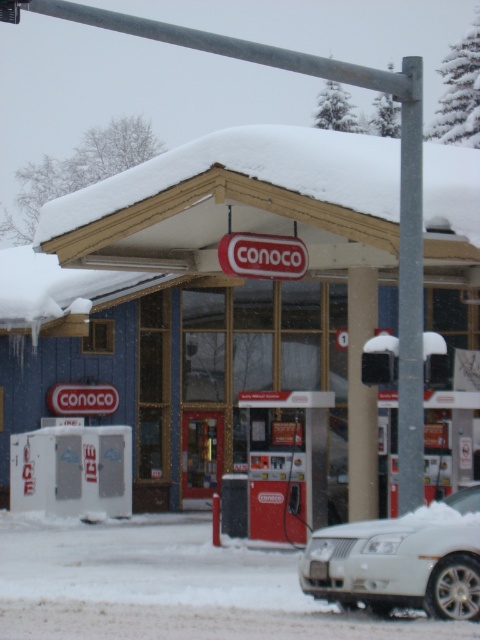
Question: Which point is farther to the camera?

Choices:
 (A) white matte car at lower right
 (B) matte blue gas station at center

Answer: (B)

Question: Considering the relative positions of matte blue gas station at center and white matte car at lower right in the image provided, where is matte blue gas station at center located with respect to white matte car at lower right?

Choices:
 (A) above
 (B) below

Answer: (A)

Question: Does matte blue gas station at center have a lesser width compared to white matte car at lower right?

Choices:
 (A) yes
 (B) no

Answer: (B)

Question: Which object appears closest to the camera in this image?

Choices:
 (A) white matte car at lower right
 (B) matte blue gas station at center

Answer: (A)

Question: Where is matte blue gas station at center located in relation to white matte car at lower right in the image?

Choices:
 (A) right
 (B) left

Answer: (B)